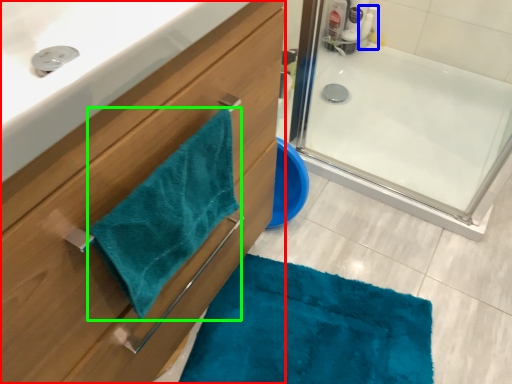
Question: Considering the real-world distances, which object is closest to bathroom cabinet (highlighted by a red box)? cleaning product (highlighted by a blue box) or beach towel (highlighted by a green box).

Choices:
 (A) cleaning product
 (B) beach towel

Answer: (B)